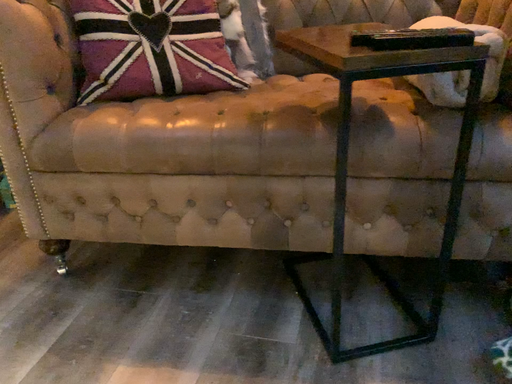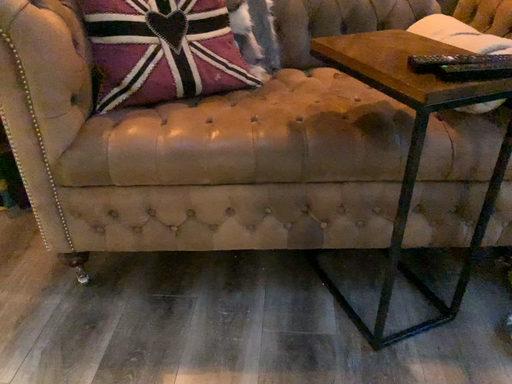
Question: Which way did the camera rotate in the video?

Choices:
 (A) rotated left
 (B) rotated right

Answer: (B)